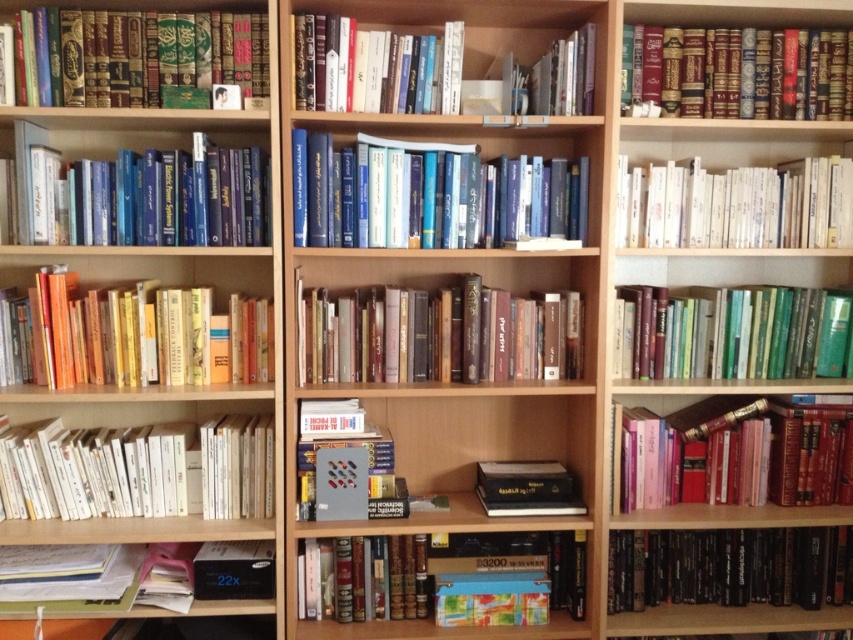
Looking at this image, you are organizing a bookshelf and need to place a new book exactly where the matte black book at upper left is currently located. According to the coordinates provided, where should you place the new book?

You should place the new book at point coordinates (134, 54) where the matte black book at upper left is currently located.

You are organizing the bookshelf and need to place a new item between the multicolored paper box at lower center and the metallic gray book at center. Where should you place it?

The multicolored paper box at lower center is located below the metallic gray book at center, so you should place the new item between them either above the box or below the book.

You are standing in front of the bookshelf and want to place a new book between the two points marked as point (553, 582) and point (349, 440). Which point should you move toward to place the book closer to the front of the bookshelf?

You should move toward point (349, 440) because it is closer to the viewer than point (553, 582), so placing the book there would be nearer to the front of the bookshelf.